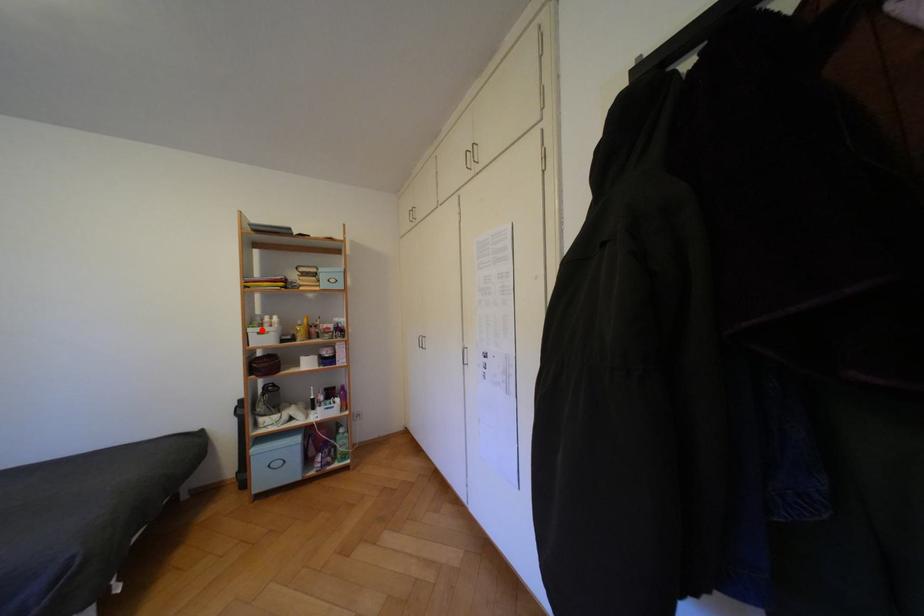
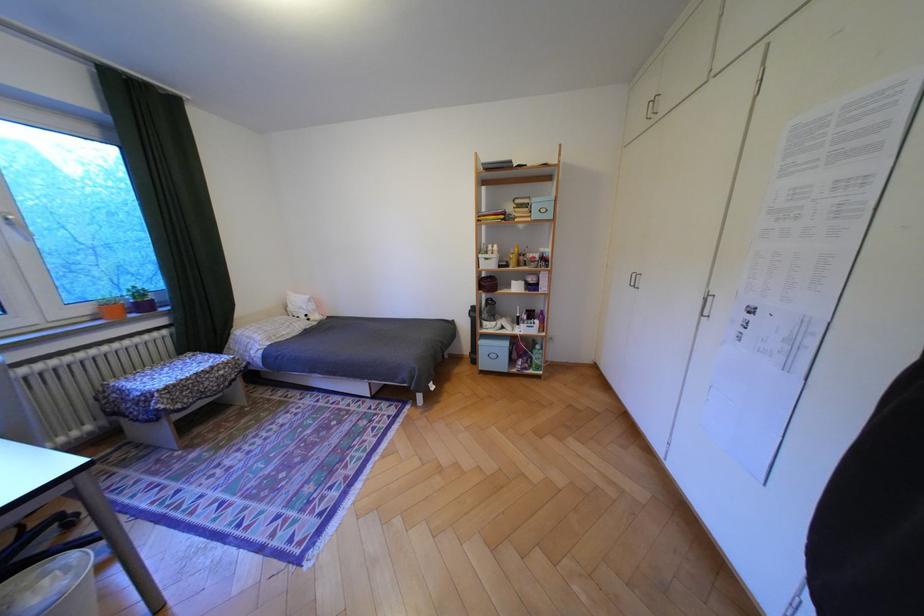
The point at the highlighted location is marked in the first image. Where is the corresponding point in the second image?

(492, 256)